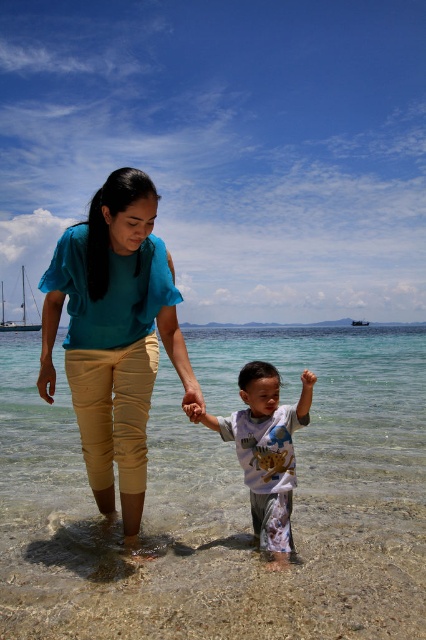
Based on the photo, you are a photographer trying to capture the child and the adult in the scene. If you want to ensure both the clear water at child right and the teal fabric shirt at center are visible in the frame, which object should be placed closer to the left side of the photo?

The teal fabric shirt at center should be placed closer to the left side of the photo because the clear water at child right is to the right of the teal fabric shirt at center.

You are a photographer trying to capture the perfect shot of the teal fabric shirt at center. Based on the scene, where should you position your camera to ensure the shirt is in the frame?

The teal fabric shirt at center is located at point coordinates (114, 333), so positioning the camera to focus on that coordinate will ensure the shirt is centered in the frame.

You are a photographer standing at the shoreline. You want to take a photo of the clear water at child right and the white cotton shirt at center. The minimum distance between the two objects must be at least 40 feet to ensure both are in focus. Can you capture them clearly in one shot?

The clear water at child right and white cotton shirt at center are 44.68 feet apart, which is more than the required 40 feet. Therefore, you can capture both clearly in one shot.